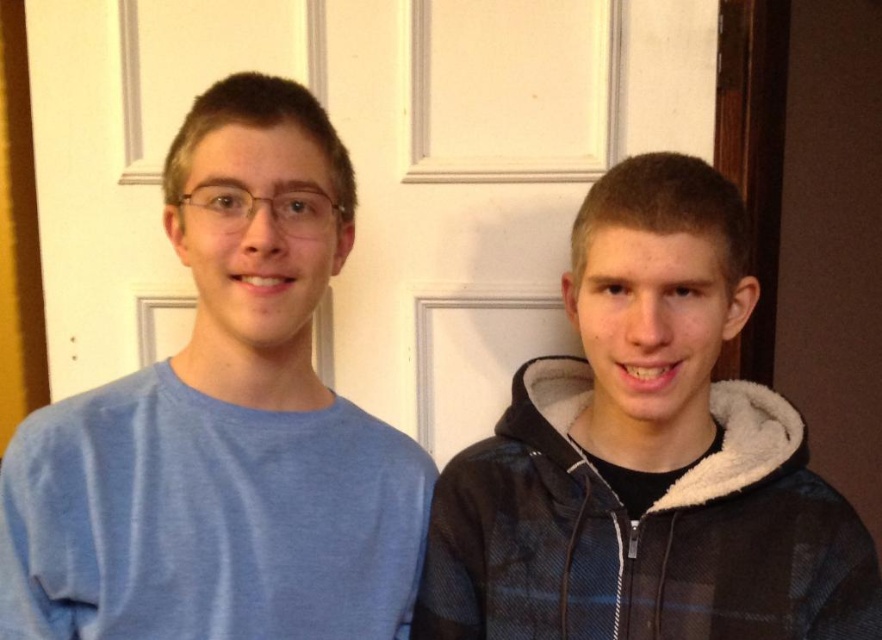
Question: Is matte blue shirt at left below black fleece hoodie at center?

Choices:
 (A) no
 (B) yes

Answer: (A)

Question: Which of the following is the farthest from the observer?

Choices:
 (A) (397, 317)
 (B) (277, 355)

Answer: (A)

Question: Can you confirm if white matte door at center is wider than matte blue shirt at left?

Choices:
 (A) yes
 (B) no

Answer: (A)

Question: Which object is farther from the camera taking this photo?

Choices:
 (A) white matte door at center
 (B) black fleece hoodie at center

Answer: (A)

Question: Is white matte door at center thinner than black fleece hoodie at center?

Choices:
 (A) no
 (B) yes

Answer: (A)

Question: Which point is closer to the camera?

Choices:
 (A) (x=111, y=490)
 (B) (x=487, y=244)

Answer: (A)